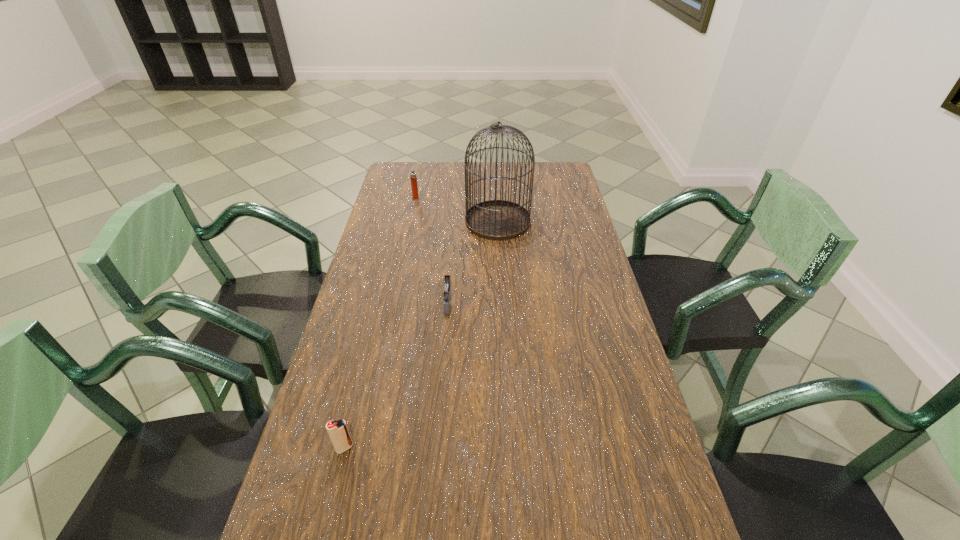
Where is `free location that satisfies the following two spatial constraints: 1. on the back side of the second object from left to right; 2. on the left side of the leftmost object`? This screenshot has width=960, height=540. free location that satisfies the following two spatial constraints: 1. on the back side of the second object from left to right; 2. on the left side of the leftmost object is located at coordinates (406, 197).

This screenshot has height=540, width=960. I want to click on free space that satisfies the following two spatial constraints: 1. on the front side of the third object from right to left; 2. on the left side of the third object from left to right, so (x=393, y=303).

The width and height of the screenshot is (960, 540). In order to click on free spot that satisfies the following two spatial constraints: 1. on the back side of the third object from left to right; 2. on the left side of the birdcage in this screenshot , I will do `click(454, 221)`.